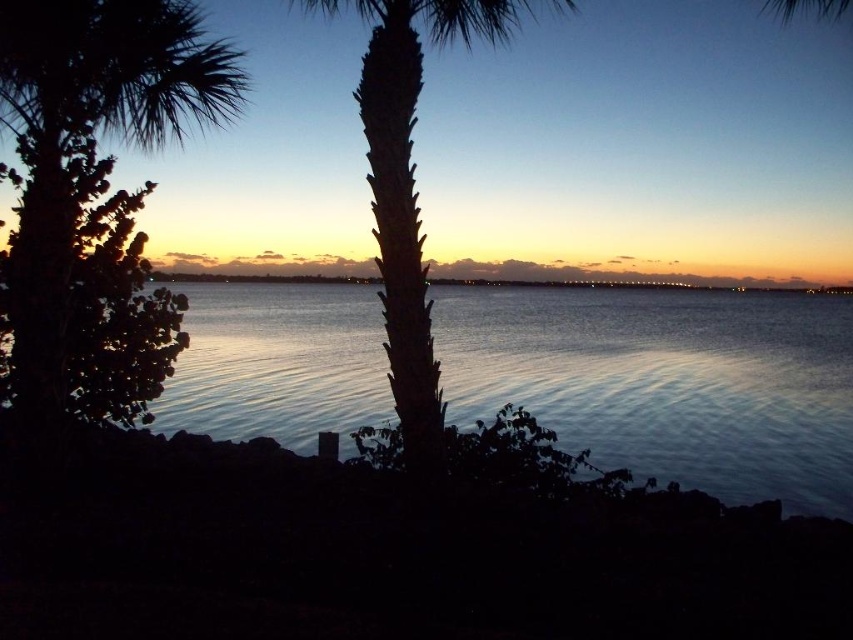
You are standing at the point closer to the horizon in this sunset scene. Which point are you standing at, point (65, 394) or point (390, 182)?

You are standing at point (390, 182) because it is closer to the horizon compared to point (65, 394), which is nearer to the viewer.

You are an architect planning to install a decorative light pole between the silvery reflective water at center and the green leafy palm tree at upper left. Given that the light pole requires 1 meter of space on each side, can the pole be placed between them without touching either object?

The silvery reflective water at center is wider than the green leafy palm tree at upper left. However, the question is about placing a light pole between them, which requires knowing the distance between the two objects, not their widths. Since the provided description only states the width comparison and not the distance between them, it is impossible to determine if the pole can fit without additional information about their separation.

You are standing at the water edge in the sunset scene. There is a point marked at coordinates point [517,364]. Can you reach that point without getting wet?

The point [517,364] is 21.53 meters away from the viewer, so yes, you can reach it without getting wet since it is within a safe distance from your current position.